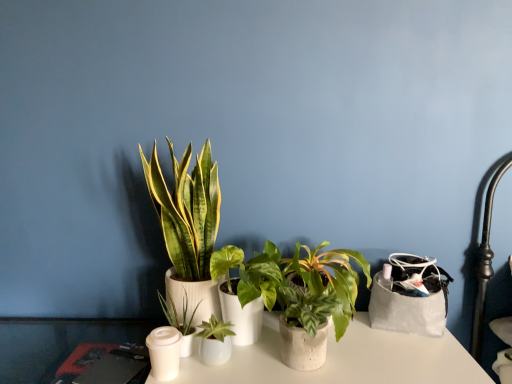
Question: Is green matte plant at center, the 2th houseplant positioned from the left, located outside green matte plant at center, acting as the second houseplant starting from the right?

Choices:
 (A) no
 (B) yes

Answer: (B)

Question: Can you confirm if green matte plant at center, which ranks as the 4th houseplant in right-to-left order, is shorter than green matte plant at center, the 4th houseplant from the left?

Choices:
 (A) yes
 (B) no

Answer: (A)

Question: Does green matte plant at center, which ranks as the 4th houseplant in right-to-left order, have a lesser width compared to green matte plant at center, acting as the second houseplant starting from the right?

Choices:
 (A) no
 (B) yes

Answer: (B)

Question: Is green matte plant at center, which ranks as the 4th houseplant in right-to-left order, smaller than green matte plant at center, acting as the second houseplant starting from the right?

Choices:
 (A) yes
 (B) no

Answer: (A)

Question: Does green matte plant at center, the 2th houseplant positioned from the left, contain green matte plant at center, acting as the second houseplant starting from the right?

Choices:
 (A) yes
 (B) no

Answer: (B)

Question: From a real-world perspective, is green matte plant at center, the 2th houseplant positioned from the left, positioned above or below white matte candle holder at lower left?

Choices:
 (A) above
 (B) below

Answer: (A)

Question: Looking at the image, does green matte plant at center, the 2th houseplant positioned from the left, seem bigger or smaller compared to white matte candle holder at lower left?

Choices:
 (A) small
 (B) big

Answer: (B)

Question: Is green matte plant at center, the 2th houseplant positioned from the left, to the left or to the right of white matte candle holder at lower left in the image?

Choices:
 (A) left
 (B) right

Answer: (B)

Question: Is green matte plant at center, the 2th houseplant positioned from the left, in front of or behind white matte candle holder at lower left in the image?

Choices:
 (A) behind
 (B) front

Answer: (A)

Question: From their relative heights in the image, would you say green matte plant at center, marked as the 3th houseplant in a right-to-left arrangement, is taller or shorter than green leafy plant at center, the first houseplant viewed from the left?

Choices:
 (A) tall
 (B) short

Answer: (B)

Question: From a real-world perspective, is green matte plant at center, marked as the 3th houseplant in a right-to-left arrangement, positioned above or below green leafy plant at center, the first houseplant viewed from the left?

Choices:
 (A) above
 (B) below

Answer: (B)

Question: Would you say green matte plant at center, marked as the 3th houseplant in a right-to-left arrangement, is to the left or to the right of green leafy plant at center, the first houseplant viewed from the left, in the picture?

Choices:
 (A) right
 (B) left

Answer: (A)

Question: In terms of width, does green matte plant at center, which is counted as the 3th houseplant, starting from the left, look wider or thinner when compared to green leafy plant at center, the first houseplant viewed from the left?

Choices:
 (A) wide
 (B) thin

Answer: (B)

Question: Does point (162, 352) appear closer or farther from the camera than point (228, 279)?

Choices:
 (A) farther
 (B) closer

Answer: (B)

Question: In terms of size, does white matte candle holder at lower left appear bigger or smaller than green matte plant at center, acting as the second houseplant starting from the right?

Choices:
 (A) big
 (B) small

Answer: (B)